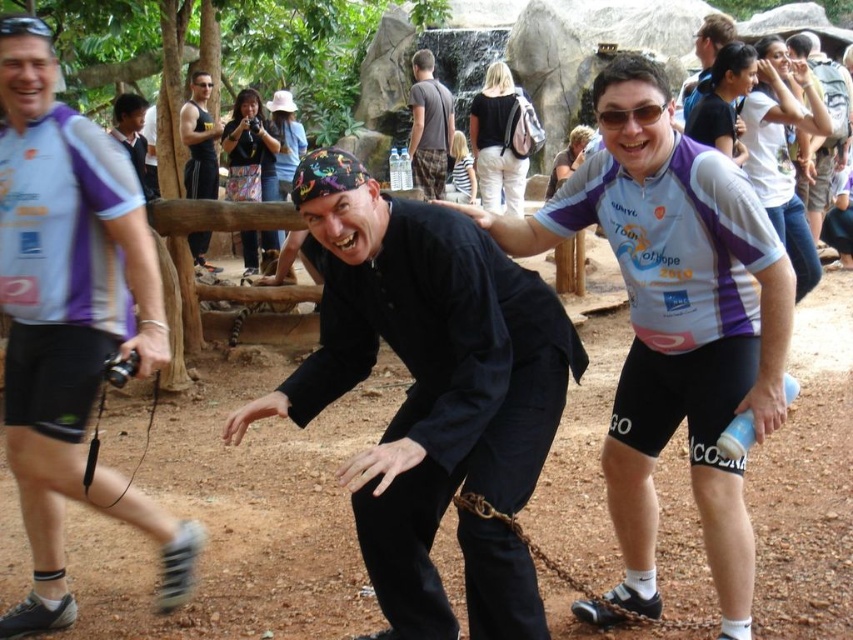
Can you confirm if sunglasses at center is taller than black rubber goggles at upper left?

No, sunglasses at center is not taller than black rubber goggles at upper left.

Who is positioned more to the left, sunglasses at center or black rubber goggles at upper left?

black rubber goggles at upper left

The image size is (853, 640). I want to click on sunglasses at center, so click(x=631, y=115).

Can you confirm if purple/white cycling jersey at center is smaller than striped fabric shirt at center?

No.

Can you confirm if purple/white cycling jersey at center is positioned to the right of striped fabric shirt at center?

Yes, purple/white cycling jersey at center is to the right of striped fabric shirt at center.

What do you see at coordinates (677, 337) in the screenshot? Image resolution: width=853 pixels, height=640 pixels. I see `purple/white cycling jersey at center` at bounding box center [677, 337].

Where is `purple/white cycling jersey at center`? purple/white cycling jersey at center is located at coordinates (677, 337).

Can you confirm if matte purple jersey at center is shorter than sunglasses at center?

Incorrect, matte purple jersey at center's height does not fall short of sunglasses at center's.

This screenshot has height=640, width=853. What do you see at coordinates (567, 157) in the screenshot? I see `matte purple jersey at center` at bounding box center [567, 157].

Does point (544, 198) come behind point (602, 129)?

Yes, point (544, 198) is behind point (602, 129).

Locate an element on the screen. This screenshot has width=853, height=640. matte purple jersey at center is located at coordinates (567, 157).